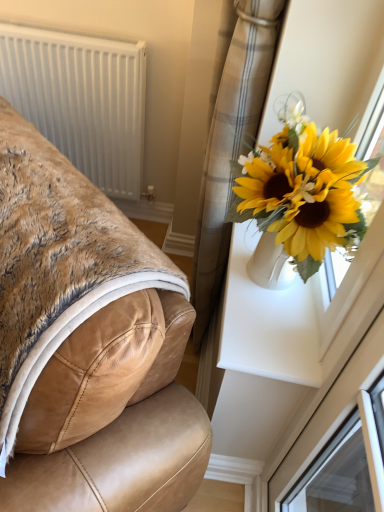
Identify the location of white plastic radiator at upper left. (81, 100).

Identify the location of plaid fabric curtain at upper right. This screenshot has height=512, width=384. (231, 143).

Identify the location of white plastic window frame at upper right. (366, 234).

From the picture: Considering the sizes of objects tan leather chair at left and white plastic window frame at upper right in the image provided, who is smaller, tan leather chair at left or white plastic window frame at upper right?

white plastic window frame at upper right is smaller.

Does tan leather chair at left turn towards white plastic window frame at upper right?

No.

Considering the positions of objects tan leather chair at left and white plastic window frame at upper right in the image provided, who is more to the right, tan leather chair at left or white plastic window frame at upper right?

From the viewer's perspective, white plastic window frame at upper right appears more on the right side.

Is tan leather chair at left not near white plastic window frame at upper right?

tan leather chair at left is near white plastic window frame at upper right, not far away.

Between plaid fabric curtain at upper right and tan leather chair at left, which one has larger width?

With larger width is tan leather chair at left.

Based on the photo, in terms of height, does plaid fabric curtain at upper right look taller or shorter compared to tan leather chair at left?

In the image, plaid fabric curtain at upper right appears to be taller than tan leather chair at left.

Measure the distance between plaid fabric curtain at upper right and tan leather chair at left.

plaid fabric curtain at upper right is 22.03 inches from tan leather chair at left.

Is plaid fabric curtain at upper right oriented away from tan leather chair at left?

plaid fabric curtain at upper right does not have its back to tan leather chair at left.

From the image's perspective, between plaid fabric curtain at upper right and white plastic window frame at upper right, who is located below?

white plastic window frame at upper right.

Is plaid fabric curtain at upper right with white plastic window frame at upper right?

No, plaid fabric curtain at upper right is not beside white plastic window frame at upper right.

From the picture: Does plaid fabric curtain at upper right have a larger size compared to white plastic window frame at upper right?

Correct, plaid fabric curtain at upper right is larger in size than white plastic window frame at upper right.

Is the position of plaid fabric curtain at upper right more distant than that of white plastic window frame at upper right?

Yes, plaid fabric curtain at upper right is behind white plastic window frame at upper right.

Is tan leather chair at left outside of plaid fabric curtain at upper right?

Absolutely, tan leather chair at left is external to plaid fabric curtain at upper right.

Which of these two, tan leather chair at left or plaid fabric curtain at upper right, stands shorter?

With less height is tan leather chair at left.

Is tan leather chair at left directly adjacent to plaid fabric curtain at upper right?

tan leather chair at left and plaid fabric curtain at upper right are not in contact.

From the image's perspective, does white plastic radiator at upper left appear higher than plaid fabric curtain at upper right?

Yes.

Would you say plaid fabric curtain at upper right is part of white plastic radiator at upper left's contents?

No, white plastic radiator at upper left does not contain plaid fabric curtain at upper right.

Are white plastic radiator at upper left and plaid fabric curtain at upper right located far from each other?

They are positioned close to each other.

Consider the image. Is white plastic radiator at upper left positioned with its back to plaid fabric curtain at upper right?

That's not correct — white plastic radiator at upper left is not looking away from plaid fabric curtain at upper right.

Are white plastic radiator at upper left and tan leather chair at left making contact?

white plastic radiator at upper left and tan leather chair at left are clearly separated.

From the picture: Which of these two, white plastic radiator at upper left or tan leather chair at left, stands shorter?

With less height is tan leather chair at left.

Is white plastic radiator at upper left positioned behind tan leather chair at left?

Yes.

From a real-world perspective, is white plastic radiator at upper left over tan leather chair at left?

No, from a real-world perspective, white plastic radiator at upper left is not on top of tan leather chair at left.

Is white plastic window frame at upper right with tan leather chair at left?

No, white plastic window frame at upper right is not with tan leather chair at left.

Is tan leather chair at left inside white plastic window frame at upper right?

No, tan leather chair at left is located outside of white plastic window frame at upper right.

Locate an element on the screen. furniture behind the white plastic window frame at upper right is located at coordinates (88, 345).

You are a GUI agent. You are given a task and a screenshot of the screen. Output one action in this format:
    pyautogui.click(x=<x>, y=<y>)
    Task: Click on the furniture that is below the plaid fabric curtain at upper right (from the image's perspective)
    
    Given the screenshot: What is the action you would take?
    pyautogui.click(x=88, y=345)

Looking at the image, which one is located further to tan leather chair at left, plaid fabric curtain at upper right or white plastic radiator at upper left?

The object further to tan leather chair at left is white plastic radiator at upper left.

Looking at the image, which one is located further to white plastic window frame at upper right, tan leather chair at left or plaid fabric curtain at upper right?

tan leather chair at left is positioned further to the anchor white plastic window frame at upper right.

Which object lies further to the anchor point white plastic radiator at upper left, plaid fabric curtain at upper right or white plastic window frame at upper right?

white plastic window frame at upper right.

Estimate the real-world distances between objects in this image. Which object is further from plaid fabric curtain at upper right, tan leather chair at left or white plastic radiator at upper left?

white plastic radiator at upper left.

Based on their spatial positions, is white plastic window frame at upper right or white plastic radiator at upper left closer to plaid fabric curtain at upper right?

white plastic window frame at upper right.

Estimate the real-world distances between objects in this image. Which object is further from tan leather chair at left, white plastic radiator at upper left or plaid fabric curtain at upper right?

Based on the image, white plastic radiator at upper left appears to be further to tan leather chair at left.

From the image, which object appears to be nearer to tan leather chair at left, white plastic window frame at upper right or plaid fabric curtain at upper right?

Among the two, white plastic window frame at upper right is located nearer to tan leather chair at left.

Considering their positions, is white plastic radiator at upper left positioned closer to plaid fabric curtain at upper right than white plastic window frame at upper right?

The object closer to plaid fabric curtain at upper right is white plastic window frame at upper right.

Where is `furniture between white plastic window frame at upper right and white plastic radiator at upper left in the front-back direction`? The height and width of the screenshot is (512, 384). furniture between white plastic window frame at upper right and white plastic radiator at upper left in the front-back direction is located at coordinates (88, 345).

Where is `curtain between tan leather chair at left and white plastic window frame at upper right from left to right`? curtain between tan leather chair at left and white plastic window frame at upper right from left to right is located at coordinates pyautogui.click(x=231, y=143).

You are a GUI agent. You are given a task and a screenshot of the screen. Output one action in this format:
    pyautogui.click(x=<x>, y=<y>)
    Task: Click on the curtain between tan leather chair at left and white plastic radiator at upper left from front to back
    This screenshot has width=384, height=512.
    Given the screenshot: What is the action you would take?
    pyautogui.click(x=231, y=143)

Image resolution: width=384 pixels, height=512 pixels. In order to click on curtain between white plastic window frame at upper right and white plastic radiator at upper left in the front-back direction in this screenshot , I will do `click(231, 143)`.